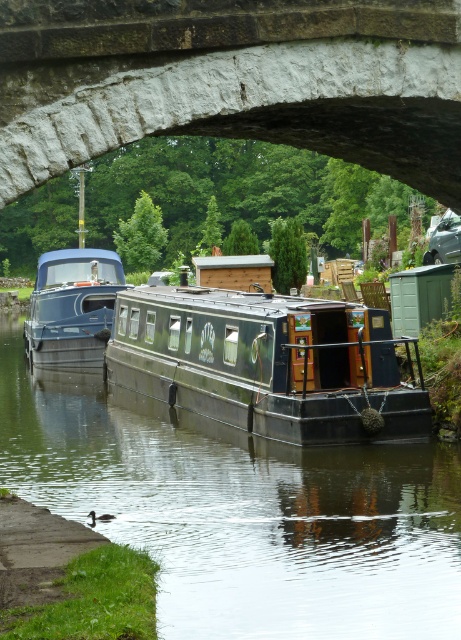
Question: From the image, what is the correct spatial relationship of stone arch at center in relation to dark green wooden barge at center?

Choices:
 (A) above
 (B) below

Answer: (A)

Question: Where is green matte boat at center located in relation to dark green wooden barge at center in the image?

Choices:
 (A) above
 (B) below

Answer: (B)

Question: Which object is positioned farthest from the matte blue boat at left?

Choices:
 (A) green matte boat at center
 (B) dark green wooden barge at center

Answer: (B)

Question: Considering the real-world distances, which object is farthest from the dark green wooden barge at center?

Choices:
 (A) green matte boat at center
 (B) matte blue boat at left
 (C) stone arch at center

Answer: (C)

Question: Which of the following is the closest to the observer?

Choices:
 (A) stone arch at center
 (B) green matte boat at center
 (C) dark green wooden barge at center
 (D) matte blue boat at left

Answer: (A)

Question: Is dark green wooden barge at center smaller than matte blue boat at left?

Choices:
 (A) yes
 (B) no

Answer: (B)